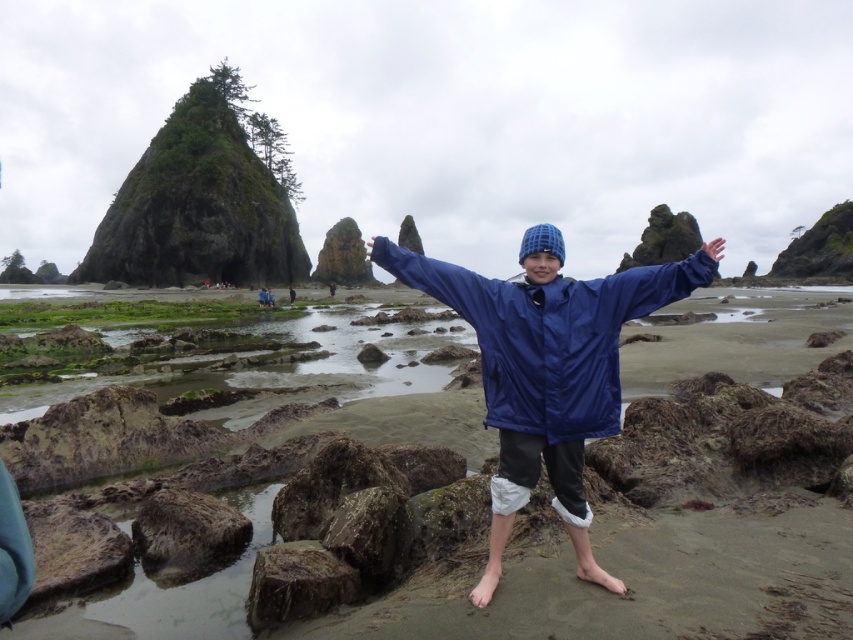
Is blue shiny jacket at center above blue fabric hand at upper center?

No.

Does blue shiny jacket at center have a smaller size compared to blue fabric hand at upper center?

No, blue shiny jacket at center is not smaller than blue fabric hand at upper center.

Locate an element on the screen. This screenshot has height=640, width=853. blue shiny jacket at center is located at coordinates (548, 336).

Locate an element on the screen. blue shiny jacket at center is located at coordinates (548, 336).

Is blue fabric jacket at center to the left of blue fabric hand at upper center from the viewer's perspective?

No, blue fabric jacket at center is not to the left of blue fabric hand at upper center.

Between point (77, 636) and point (705, 250), which one is positioned behind?

The point (705, 250) is behind.

Where is `blue fabric jacket at center`? The width and height of the screenshot is (853, 640). blue fabric jacket at center is located at coordinates (175, 596).

Which is above, blue fabric jacket at center or blue shiny jacket at center?

blue fabric jacket at center is higher up.

How distant is blue fabric jacket at center from blue shiny jacket at center?

blue fabric jacket at center and blue shiny jacket at center are 24.18 meters apart.

Who is more forward, (x=738, y=294) or (x=495, y=340)?

Positioned in front is point (x=495, y=340).

Where is `blue fabric jacket at center`? Image resolution: width=853 pixels, height=640 pixels. blue fabric jacket at center is located at coordinates (175, 596).